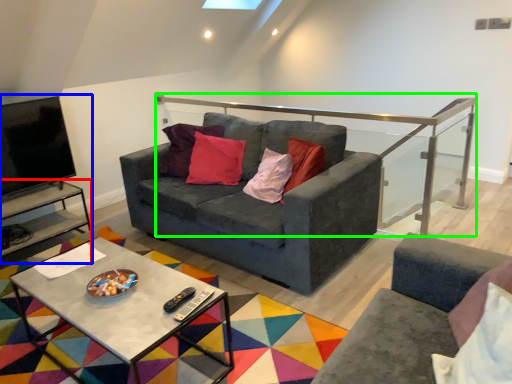
Question: Which object is positioned farthest from side table (highlighted by a red box)? Select from entertainment center (highlighted by a blue box) and balustrade (highlighted by a green box).

Choices:
 (A) entertainment center
 (B) balustrade

Answer: (B)